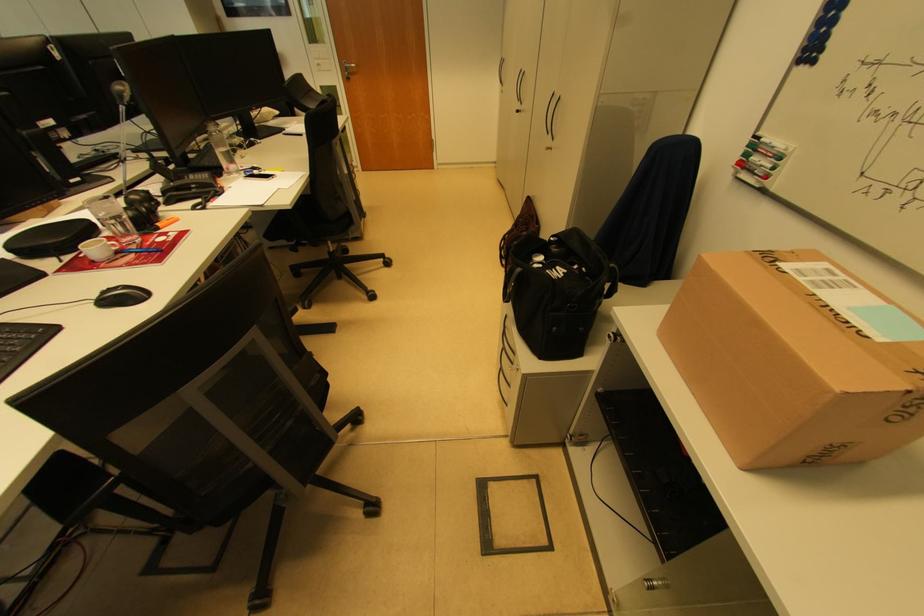
Where would you grasp the blue whiteboard marker? Please return your answer as a coordinate pair (x, y).

(139, 249)